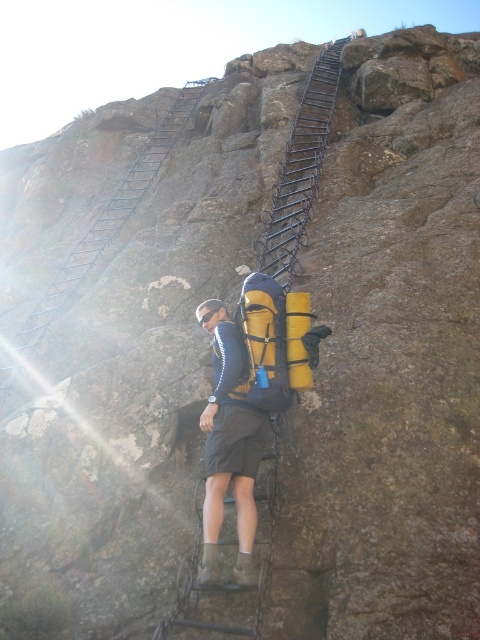
Does point (177, 579) lie in front of point (85, 262)?

Yes, point (177, 579) is in front of point (85, 262).

This screenshot has height=640, width=480. In order to click on black metal ladder at center in this screenshot , I will do `click(301, 166)`.

Can you confirm if metallic black ladder at upper left is positioned above metallic black ladder at upper center?

No.

Who is more forward, (26, 330) or (321, 77)?

Point (26, 330) is in front.

The image size is (480, 640). Find the location of `metallic black ladder at upper left`. metallic black ladder at upper left is located at coordinates (99, 234).

Can you confirm if black metal ladder at center is thinner than metallic black ladder at upper center?

Incorrect, black metal ladder at center's width is not less than metallic black ladder at upper center's.

Is black metal ladder at center bigger than metallic black ladder at upper center?

Correct, black metal ladder at center is larger in size than metallic black ladder at upper center.

The height and width of the screenshot is (640, 480). In order to click on black metal ladder at center in this screenshot , I will do click(301, 166).